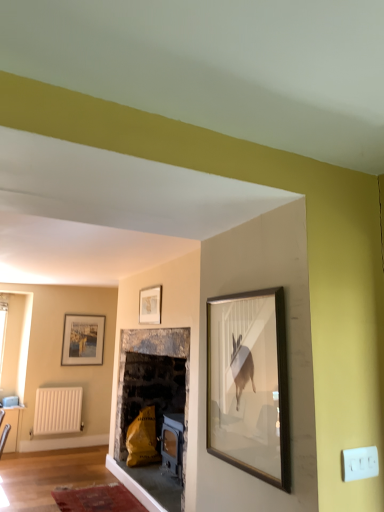
Question: From a real-world perspective, is wooden picture frame at upper center, which is the 1th picture frame from right to left, located higher than white matte radiator at lower left?

Choices:
 (A) yes
 (B) no

Answer: (A)

Question: Is wooden picture frame at upper center, acting as the 1th picture frame starting from the top, closer to the viewer compared to white matte radiator at lower left?

Choices:
 (A) no
 (B) yes

Answer: (B)

Question: Is wooden picture frame at upper center, the first picture frame from the front, positioned with its back to white matte radiator at lower left?

Choices:
 (A) no
 (B) yes

Answer: (A)

Question: Does wooden picture frame at upper center, which is the 1th picture frame from right to left, have a greater width compared to white matte radiator at lower left?

Choices:
 (A) yes
 (B) no

Answer: (B)

Question: Is wooden picture frame at upper center, which is the 1th picture frame from right to left, smaller than white matte radiator at lower left?

Choices:
 (A) no
 (B) yes

Answer: (B)

Question: Considering the positions of point (61, 350) and point (140, 313), is point (61, 350) closer or farther from the camera than point (140, 313)?

Choices:
 (A) farther
 (B) closer

Answer: (A)

Question: Is matte white picture frame at left, the second picture frame from the top, bigger or smaller than wooden picture frame at upper center, arranged as the second picture frame when ordered from the bottom?

Choices:
 (A) big
 (B) small

Answer: (A)

Question: Relative to wooden picture frame at upper center, the first picture frame from the front, is matte white picture frame at left, which is counted as the second picture frame, starting from the right, in front or behind?

Choices:
 (A) front
 (B) behind

Answer: (B)

Question: Do you think matte white picture frame at left, which appears as the 1th picture frame when viewed from the back, is within wooden picture frame at upper center, which is the 1th picture frame from right to left, or outside of it?

Choices:
 (A) inside
 (B) outside

Answer: (B)

Question: From their relative heights in the image, would you say white matte radiator at lower left is taller or shorter than wooden picture frame at upper center, acting as the 1th picture frame starting from the top?

Choices:
 (A) tall
 (B) short

Answer: (A)

Question: Is point (74, 429) positioned closer to the camera than point (160, 322)?

Choices:
 (A) farther
 (B) closer

Answer: (A)

Question: Considering the relative positions of white matte radiator at lower left and wooden picture frame at upper center, which is the 1th picture frame from right to left, in the image provided, is white matte radiator at lower left to the left or to the right of wooden picture frame at upper center, which is the 1th picture frame from right to left,?

Choices:
 (A) left
 (B) right

Answer: (A)

Question: Considering their positions, is white matte radiator at lower left located in front of or behind wooden picture frame at upper center, arranged as the second picture frame when ordered from the bottom?

Choices:
 (A) front
 (B) behind

Answer: (B)

Question: Is matte white picture frame at left, the second picture frame from the top, spatially inside white matte radiator at lower left, or outside of it?

Choices:
 (A) outside
 (B) inside

Answer: (A)

Question: Is matte white picture frame at left, acting as the 1th picture frame starting from the left, wider or thinner than white matte radiator at lower left?

Choices:
 (A) thin
 (B) wide

Answer: (A)